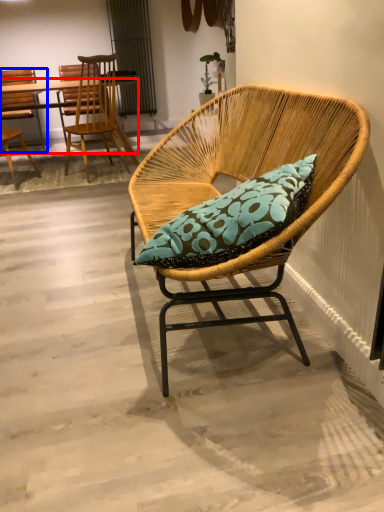
Question: Among these objects, which one is nearest to the camera, desk (highlighted by a red box) or chair (highlighted by a blue box)?

Choices:
 (A) desk
 (B) chair

Answer: (A)